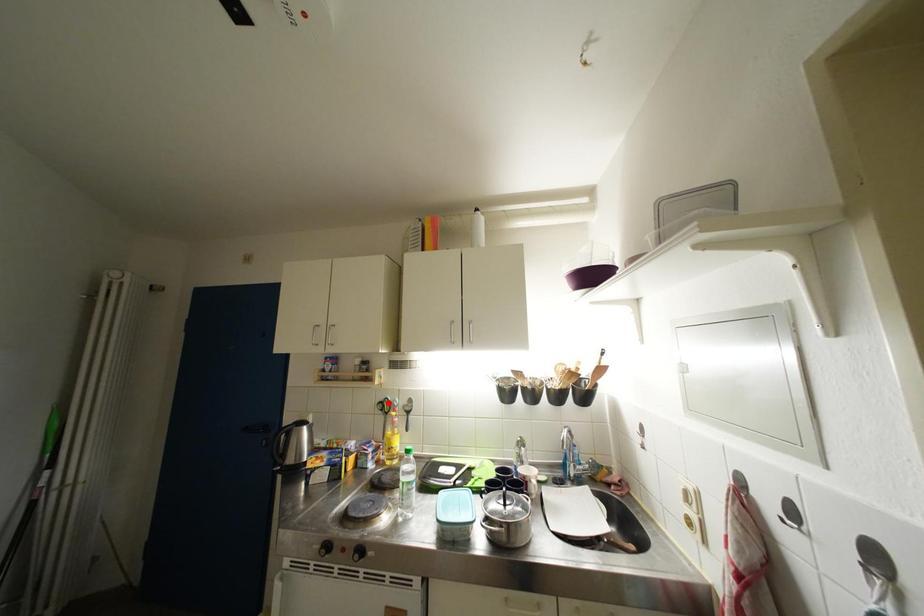
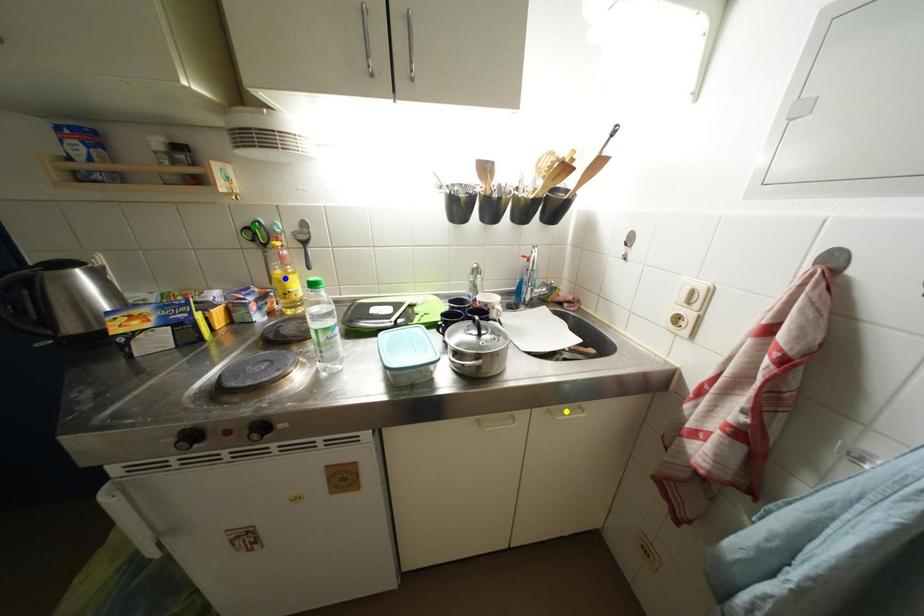
Question: I am providing you with two images of the same scene from different viewpoints. A red point is marked on the first image. You are given multiple points on the second image. Which mark in image 2 goes with the point in image 1?

Choices:
 (A) green point
 (B) blue point
 (C) yellow point

Answer: (A)